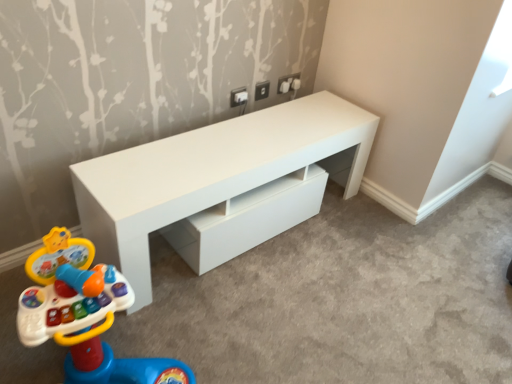
The width and height of the screenshot is (512, 384). Find the location of `vacant space to the right of white glossy table at center`. vacant space to the right of white glossy table at center is located at coordinates (393, 260).